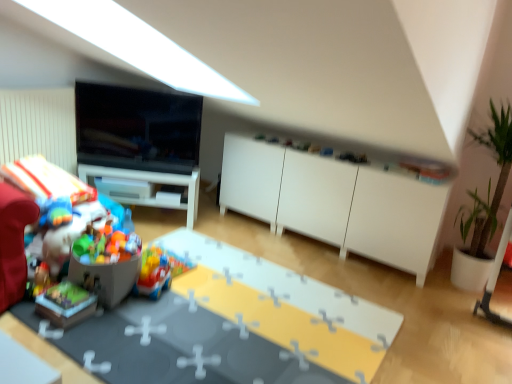
Question: Considering the positions of wooden block at lower left, arranged as the 2th toy when viewed from the left, and matte plastic table at lower left in the image, is wooden block at lower left, arranged as the 2th toy when viewed from the left, bigger or smaller than matte plastic table at lower left?

Choices:
 (A) big
 (B) small

Answer: (B)

Question: In terms of height, does wooden block at lower left, the 3th toy positioned from the right, look taller or shorter compared to matte plastic table at lower left?

Choices:
 (A) short
 (B) tall

Answer: (B)

Question: Which is farther from the matte black tv at upper left?

Choices:
 (A) plastic colorful toys at lower left, marked as the third toy in a left-to-right arrangement
 (B) wooden block at lower left, the 3th toy positioned from the right
 (C) white glossy desk at center
 (D) white matte cabinet at center
 (E) green leafy plant in pot at right

Answer: (E)

Question: Which object is the closest to the multicolored plastic toys at left, which is the 4th toy from right to left?

Choices:
 (A) white matte cabinet at center
 (B) wooden block at lower left, the 3th toy positioned from the right
 (C) matte plastic table at lower left
 (D) white glossy desk at center
 (E) matte black tv at upper left

Answer: (B)